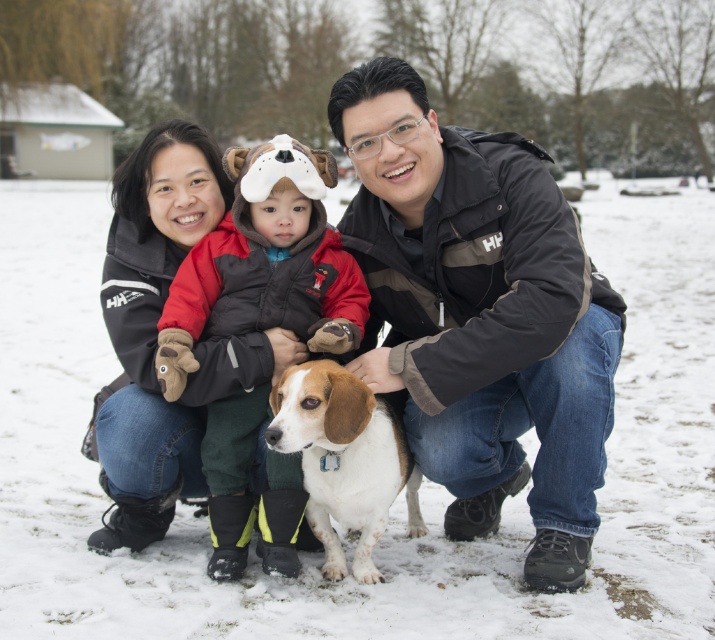
You are an outdoor photographer trying to capture the family and their dog in the snow. You want to place a decorative snowflake sticker on the photo exactly where the white fluffy snow at center is located. What coordinates should you use to position the sticker?

The coordinates for the white fluffy snow at center are at point (398, 496), so you should place the sticker there.

You are a photographer trying to capture a closeup shot of the velvet brown vest at center. Given that the white fluffy snow at center is in the way, can you determine if you can move the snow to get a clear view of the vest?

The white fluffy snow at center is larger in size than the velvet brown vest at center, so it might block the view. However, since the snow is at the same center position as the vest, moving it could allow the vest to be visible.